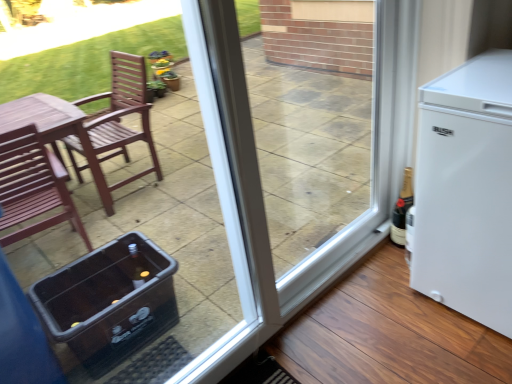
What is the approximate height of white matte refrigerator at right?

The height of white matte refrigerator at right is 33.44 inches.

Measure the distance between point (396,203) and camera.

The distance of point (396,203) from camera is 1.93 meters.

Measure the distance between point (349, 105) and camera.

They are 4.10 meters apart.

The image size is (512, 384). I want to click on transparent glass screen door at center, so click(306, 156).

At what (x,y) coordinates should I click in order to perform the action: click on white matte refrigerator at right. Please return your answer as a coordinate pair (x, y). The width and height of the screenshot is (512, 384). Looking at the image, I should click on (466, 191).

The width and height of the screenshot is (512, 384). What are the coordinates of `refrigerator above the black glass bottle at right (from a real-world perspective)` in the screenshot? It's located at (466, 191).

Between white matte refrigerator at right and black glass bottle at right, which one has smaller width?

Thinner between the two is black glass bottle at right.

Would you say white matte refrigerator at right is a long distance from black glass bottle at right?

That's not correct — white matte refrigerator at right is a little close to black glass bottle at right.

From a real-world perspective, is white matte refrigerator at right positioned over transparent plastic cooler at lower left based on gravity?

Actually, white matte refrigerator at right is physically below transparent plastic cooler at lower left in the real world.

Is white matte refrigerator at right surrounding transparent plastic cooler at lower left?

No, transparent plastic cooler at lower left is not surrounded by white matte refrigerator at right.

Which is in front, point (480, 231) or point (141, 203)?

The point (480, 231) is in front.

Is white matte refrigerator at right aimed at transparent plastic cooler at lower left?

Yes, white matte refrigerator at right is aimed at transparent plastic cooler at lower left.

Does black glass bottle at right have a smaller size compared to white matte refrigerator at right?

Correct, black glass bottle at right occupies less space than white matte refrigerator at right.

Considering the relative positions of black glass bottle at right and white matte refrigerator at right in the image provided, is black glass bottle at right to the left of white matte refrigerator at right from the viewer's perspective?

Yes.

Who is more distant, black glass bottle at right or white matte refrigerator at right?

black glass bottle at right is further from the camera.

Which of these two, black glass bottle at right or white matte refrigerator at right, is thinner?

With smaller width is black glass bottle at right.

Does transparent plastic cooler at lower left appear on the left side of black glass bottle at right?

Correct, you'll find transparent plastic cooler at lower left to the left of black glass bottle at right.

From the image's perspective, is transparent plastic cooler at lower left on black glass bottle at right?

Incorrect, from the image's perspective, transparent plastic cooler at lower left is lower than black glass bottle at right.

Does transparent plastic cooler at lower left have a larger size compared to black glass bottle at right?

Indeed, transparent plastic cooler at lower left has a larger size compared to black glass bottle at right.

Considering the sizes of objects black glass bottle at right and transparent plastic cooler at lower left in the image provided, who is bigger, black glass bottle at right or transparent plastic cooler at lower left?

transparent plastic cooler at lower left is bigger.

Is black glass bottle at right to the left or to the right of transparent plastic cooler at lower left in the image?

In the image, black glass bottle at right appears on the right side of transparent plastic cooler at lower left.

Between black glass bottle at right and transparent plastic cooler at lower left, which one is positioned behind?

black glass bottle at right is more distant.

Are transparent plastic cooler at lower left and white matte refrigerator at right making contact?

No, transparent plastic cooler at lower left is not in contact with white matte refrigerator at right.

From the image's perspective, is transparent plastic cooler at lower left located beneath white matte refrigerator at right?

→ Correct, transparent plastic cooler at lower left appears lower than white matte refrigerator at right in the image.

Does transparent plastic cooler at lower left lie in front of white matte refrigerator at right?

Yes.

From the image's perspective, between transparent glass screen door at center and black glass bottle at right, who is located below?

black glass bottle at right appears lower in the image.

Based on the photo, which is correct: transparent glass screen door at center is inside black glass bottle at right, or outside of it?

transparent glass screen door at center is spatially situated outside black glass bottle at right.

From a real-world perspective, is transparent glass screen door at center physically above black glass bottle at right?

Yes, from a real-world perspective, transparent glass screen door at center is on top of black glass bottle at right.

Is the surface of transparent glass screen door at center in direct contact with black glass bottle at right?

transparent glass screen door at center is not next to black glass bottle at right, and they're not touching.

Where is `refrigerator on the right of the black glass bottle at right`? refrigerator on the right of the black glass bottle at right is located at coordinates (466, 191).

Identify the location of door above the white matte refrigerator at right (from a real-world perspective). (174, 233).

When comparing their distances from transparent plastic cooler at lower left, does black glass bottle at right or transparent glass screen door at center seem closer?

transparent glass screen door at center lies closer to transparent plastic cooler at lower left than the other object.

Based on their spatial positions, is transparent plastic cooler at lower left or transparent glass screen door at center closer to black glass bottle at right?

Among the two, transparent glass screen door at center is located nearer to black glass bottle at right.

Considering their positions, is black glass bottle at right positioned further to transparent plastic cooler at lower left than white matte refrigerator at right?

The object further to transparent plastic cooler at lower left is black glass bottle at right.

Considering their positions, is black glass bottle at right positioned closer to transparent glass screen door at center than white matte refrigerator at right?

The object closer to transparent glass screen door at center is white matte refrigerator at right.

Estimate the real-world distances between objects in this image. Which object is closer to white matte refrigerator at right, black glass bottle at right or transparent glass screen door at center?

Based on the image, black glass bottle at right appears to be nearer to white matte refrigerator at right.

Considering their positions, is white matte refrigerator at right positioned closer to transparent plastic cooler at lower left than transparent glass screen door at center?

transparent glass screen door at center is closer to transparent plastic cooler at lower left.

Considering their positions, is transparent glass screen door at center positioned closer to white matte refrigerator at right than transparent plastic cooler at lower left?

transparent glass screen door at center is positioned closer to the anchor white matte refrigerator at right.

Looking at the image, which one is located closer to black glass bottle at right, transparent plastic cooler at lower left or white matte refrigerator at right?

white matte refrigerator at right.

Where is `screen door between transparent plastic cooler at lower left and white matte refrigerator at right`? This screenshot has height=384, width=512. screen door between transparent plastic cooler at lower left and white matte refrigerator at right is located at coordinates (306, 156).

At what (x,y) coordinates should I click in order to perform the action: click on refrigerator between transparent glass screen door at center and black glass bottle at right in the front-back direction. Please return your answer as a coordinate pair (x, y). Image resolution: width=512 pixels, height=384 pixels. Looking at the image, I should click on (466, 191).

At what (x,y) coordinates should I click in order to perform the action: click on screen door positioned between transparent plastic cooler at lower left and black glass bottle at right from near to far. Please return your answer as a coordinate pair (x, y). Image resolution: width=512 pixels, height=384 pixels. Looking at the image, I should click on (306, 156).

Find the location of a particular element. This screenshot has height=384, width=512. refrigerator between transparent plastic cooler at lower left and black glass bottle at right along the z-axis is located at coordinates (466, 191).